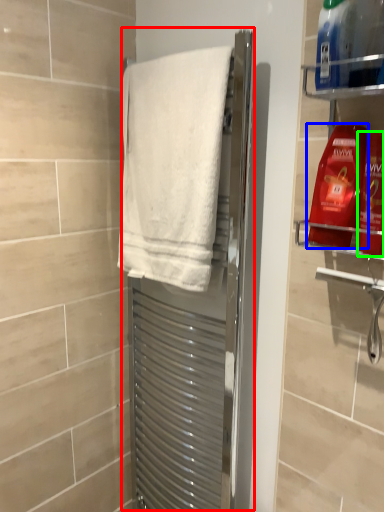
Question: Based on their relative distances, which object is farther from screen door (highlighted by a red box)? Choose from cleaning product (highlighted by a blue box) and cleaning product (highlighted by a green box).

Choices:
 (A) cleaning product
 (B) cleaning product

Answer: (B)